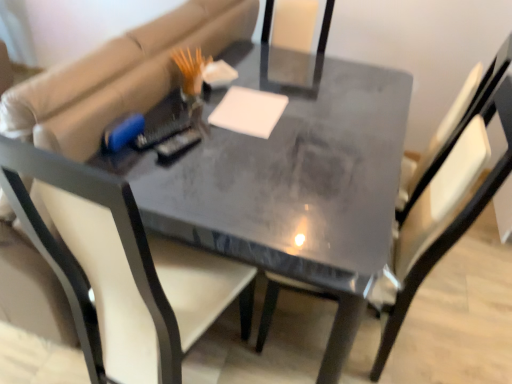
Where is `vacant location below white matte notepad at center (from a real-world perspective)`? This screenshot has height=384, width=512. vacant location below white matte notepad at center (from a real-world perspective) is located at coordinates (250, 112).